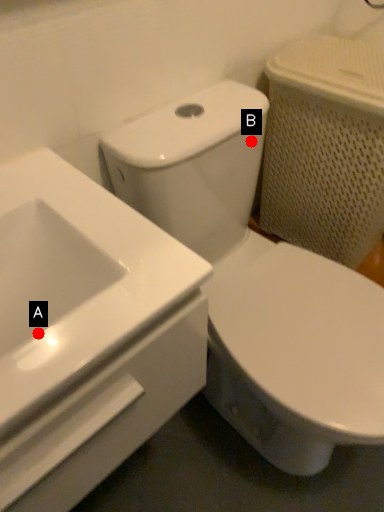
Question: Two points are circled on the image, labeled by A and B beside each circle. Among these points, which one is nearest to the camera?

Choices:
 (A) A is closer
 (B) B is closer

Answer: (A)